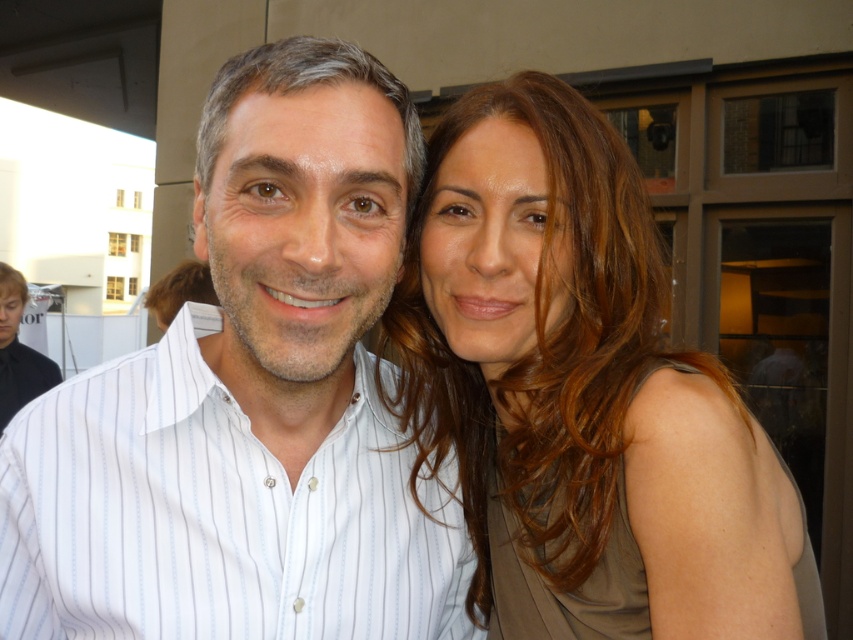
You are a photographer trying to capture a closeup of the white striped shirt at center and the matte brown hair at upper right. The camera can only focus on objects within 20 centimeters. Will both subjects be in focus?

The white striped shirt at center is 20.72 centimeters away from matte brown hair at upper right. Since the distance between them is more than 20 centimeters, the camera cannot focus on both subjects simultaneously.

You are a photographer holding a camera and want to take a portrait of the person wearing the white striped shirt at center. The recommended distance for a clear portrait is at least 30 inches. Are you too close to the subject?

The white striped shirt at center and camera are 29.81 inches apart from each other. Since the recommended distance is at least 30 inches, you are slightly too close to the subject.